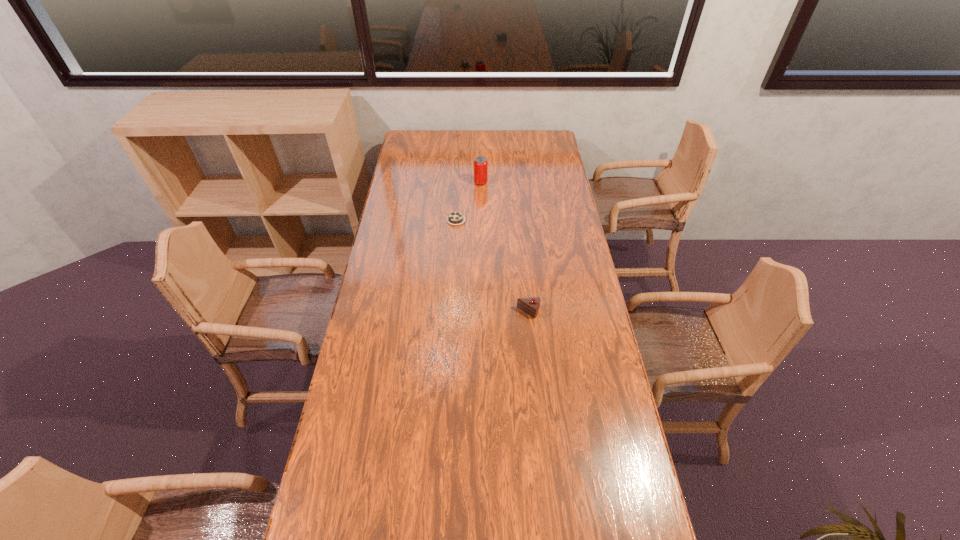
The image size is (960, 540). I want to click on can, so click(x=480, y=163).

Locate an element on the screen. the farthest object is located at coordinates (480, 163).

I want to click on the second tallest object, so (531, 306).

The width and height of the screenshot is (960, 540). Identify the location of the taller chocolate cake. (531, 306).

Find the location of a particular element. The image size is (960, 540). the shortest object is located at coordinates (455, 218).

In order to click on the farther chocolate cake in this screenshot , I will do `click(455, 218)`.

Locate an element on the screen. Image resolution: width=960 pixels, height=540 pixels. vacant space located on the right of the farthest object is located at coordinates (546, 183).

I want to click on free space located on the right of the nearest object, so click(595, 312).

Where is `free region located on the back of the second nearest object`? free region located on the back of the second nearest object is located at coordinates (459, 175).

The image size is (960, 540). Find the location of `vacant region at the left edge`. vacant region at the left edge is located at coordinates (422, 206).